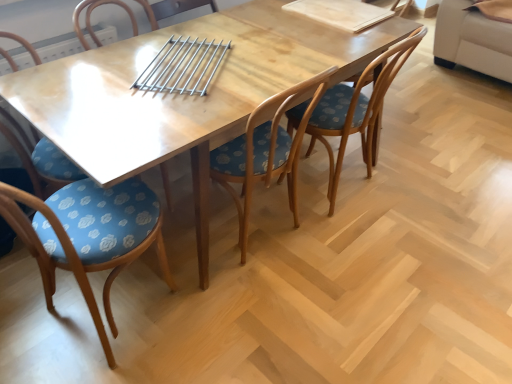
This screenshot has width=512, height=384. In order to click on vacant area situated below wooden chair with floral cushion at center, acting as the 1th chair starting from the right (from a real-world perspective) in this screenshot , I will do `click(356, 193)`.